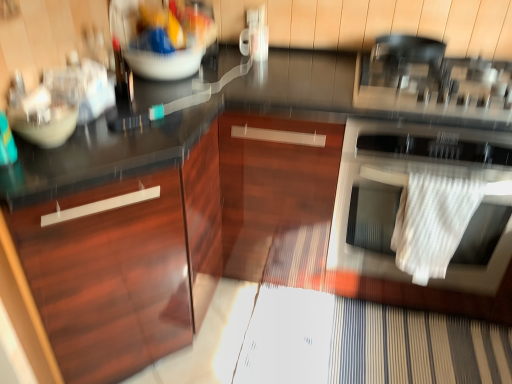
This screenshot has height=384, width=512. I want to click on vacant area that lies to the right of matte white bowl at left, so click(117, 143).